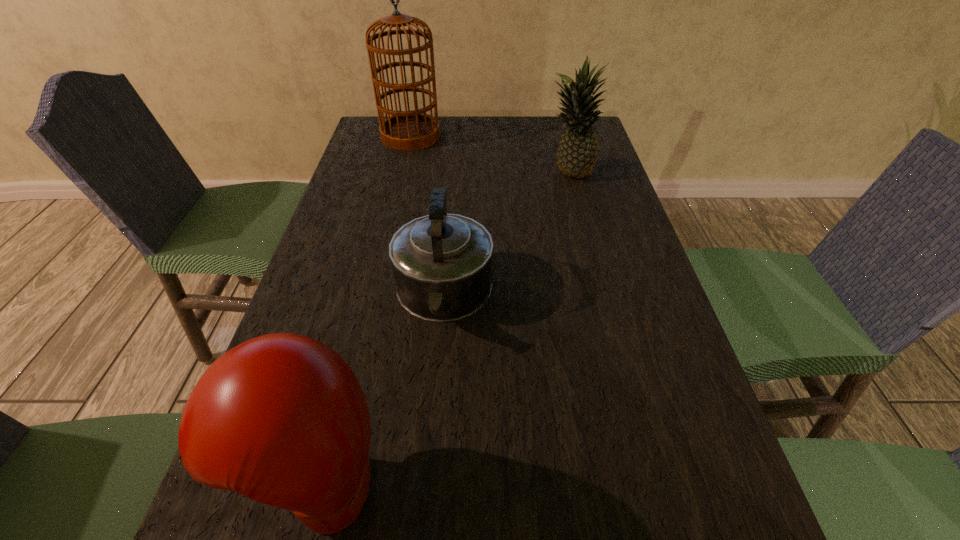
Locate an element on the screen. The height and width of the screenshot is (540, 960). object at the left edge is located at coordinates (405, 130).

Identify the location of object at the right edge. The height and width of the screenshot is (540, 960). [577, 153].

I want to click on object situated at the far left corner, so click(x=405, y=130).

The height and width of the screenshot is (540, 960). In the image, there is a desktop. Find the location of `free space at the far edge`. free space at the far edge is located at coordinates (487, 137).

The image size is (960, 540). I want to click on free space at the left edge of the desktop, so click(x=336, y=269).

Where is `vacant space at the right edge of the desktop`? This screenshot has width=960, height=540. vacant space at the right edge of the desktop is located at coordinates (600, 182).

In the image, there is a desktop. At what (x,y) coordinates should I click in order to perform the action: click on vacant region at the far left corner. Please return your answer as a coordinate pair (x, y). Looking at the image, I should click on (363, 142).

You are a GUI agent. You are given a task and a screenshot of the screen. Output one action in this format:
    pyautogui.click(x=<x>, y=<y>)
    Task: Click on the free space at the far right corner of the desktop
    The image size is (960, 540).
    Given the screenshot: What is the action you would take?
    pyautogui.click(x=553, y=136)

The width and height of the screenshot is (960, 540). In order to click on unoccupied position between the rightmost object and the birdcage in this screenshot , I will do point(490,155).

Image resolution: width=960 pixels, height=540 pixels. What are the coordinates of `free space between the kettle and the third nearest object` in the screenshot? It's located at (506, 235).